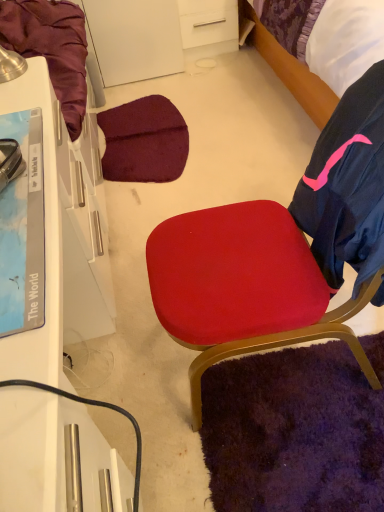
Question: From a real-world perspective, is purple fabric bed at upper right above or below white glossy desk at left?

Choices:
 (A) above
 (B) below

Answer: (B)

Question: Is purple fabric bed at upper right bigger or smaller than white glossy desk at left?

Choices:
 (A) small
 (B) big

Answer: (B)

Question: Which is farther from the white glossy desk at left?

Choices:
 (A) purple fabric bed at upper right
 (B) matte red cushion at center

Answer: (A)

Question: Estimate the real-world distances between objects in this image. Which object is farther from the purple fabric bed at upper right?

Choices:
 (A) matte red cushion at center
 (B) white glossy desk at left

Answer: (B)